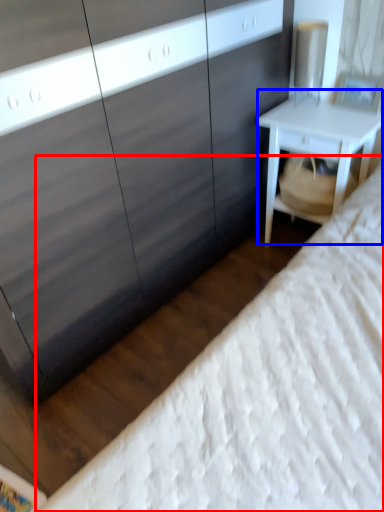
Question: Among these objects, which one is farthest to the camera, bed (highlighted by a red box) or nightstand (highlighted by a blue box)?

Choices:
 (A) bed
 (B) nightstand

Answer: (B)